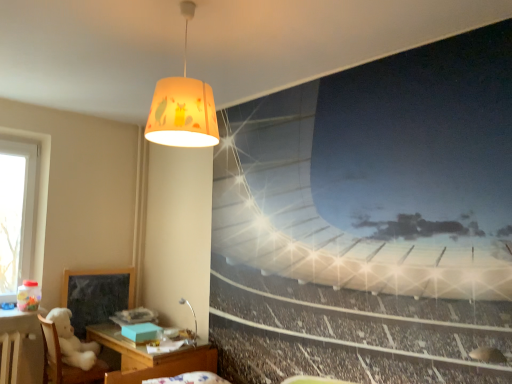
What do you see at coordinates (97, 295) in the screenshot?
I see `dark gray matte bulletin board at lower left` at bounding box center [97, 295].

Consider the image. Measure the distance between metallic silver desk lamp at lower center, arranged as the 1th lamp when ordered from the bottom, and camera.

metallic silver desk lamp at lower center, arranged as the 1th lamp when ordered from the bottom, and camera are 3.45 meters apart from each other.

In order to face metallic silver desk lamp at lower center, which is the 1th lamp in back-to-front order, should I rotate leftwards or rightwards?

To align with it, rotate left about 8.876°.

Identify the location of dark gray matte bulletin board at lower left. (97, 295).

Which object is closer to the camera, white plush bear at lower left or wooden table at lower left?

wooden table at lower left is in front.

Can you confirm if white plush bear at lower left is wider than wooden table at lower left?

Incorrect, the width of white plush bear at lower left does not surpass that of wooden table at lower left.

Would you say white plush bear at lower left is outside wooden table at lower left?

Yes.

From the image's perspective, between white plush bear at lower left and wooden table at lower left, which one is located above?

white plush bear at lower left.

Considering the sizes of objects white plush bear at lower left and matte yellow fabric lampshade at upper center, which appears as the first lamp when viewed from the top, in the image provided, who is shorter, white plush bear at lower left or matte yellow fabric lampshade at upper center, which appears as the first lamp when viewed from the top,?

With less height is matte yellow fabric lampshade at upper center, which appears as the first lamp when viewed from the top.

Is white plush bear at lower left touching matte yellow fabric lampshade at upper center, which is counted as the first lamp, starting from the front?

No, white plush bear at lower left is not touching matte yellow fabric lampshade at upper center, which is counted as the first lamp, starting from the front.

How many degrees apart are the facing directions of white plush bear at lower left and matte yellow fabric lampshade at upper center, which is counted as the 2th lamp, starting from the bottom?

They differ by 180 degrees in their facing directions.

Which is in front, white plush bear at lower left or matte yellow fabric lampshade at upper center, which appears as the first lamp when viewed from the top?

Positioned in front is matte yellow fabric lampshade at upper center, which appears as the first lamp when viewed from the top.

Is white plush bear at lower left inside the boundaries of dark gray matte bulletin board at lower left, or outside?

white plush bear at lower left cannot be found inside dark gray matte bulletin board at lower left.

Is white plush bear at lower left aimed at dark gray matte bulletin board at lower left?

No, white plush bear at lower left is not turned towards dark gray matte bulletin board at lower left.

Considering the relative positions of white plush bear at lower left and dark gray matte bulletin board at lower left in the image provided, is white plush bear at lower left behind dark gray matte bulletin board at lower left?

That is False.

Considering the positions of objects white plush bear at lower left and dark gray matte bulletin board at lower left in the image provided, who is more to the left, white plush bear at lower left or dark gray matte bulletin board at lower left?

Answer: From the viewer's perspective, white plush bear at lower left appears more on the left side.

Is point (155, 129) closer to camera compared to point (194, 343)?

Yes.

Which is in front, matte yellow fabric lampshade at upper center, which appears as the first lamp when viewed from the top, or metallic silver desk lamp at lower center, the 2th lamp in the front-to-back sequence?

matte yellow fabric lampshade at upper center, which appears as the first lamp when viewed from the top.

From a real-world perspective, which is physically below, matte yellow fabric lampshade at upper center, which is counted as the first lamp, starting from the front, or metallic silver desk lamp at lower center, which is the second lamp from top to bottom?

From a 3D spatial view, metallic silver desk lamp at lower center, which is the second lamp from top to bottom, is below.

Is matte yellow fabric lampshade at upper center, the second lamp positioned from the back, wider than metallic silver desk lamp at lower center, the 2th lamp in the front-to-back sequence?

Yes, matte yellow fabric lampshade at upper center, the second lamp positioned from the back, is wider than metallic silver desk lamp at lower center, the 2th lamp in the front-to-back sequence.

From a real-world perspective, which lamp is the 1st one above the wooden table at lower left? Please provide its 2D coordinates.

[(192, 313)]

Looking at this image, from the image's perspective, is wooden table at lower left below metallic silver desk lamp at lower center, which is the second lamp from top to bottom?

Yes, from the image's perspective, wooden table at lower left is beneath metallic silver desk lamp at lower center, which is the second lamp from top to bottom.

Considering the relative positions of metallic silver desk lamp at lower center, which is the second lamp from top to bottom, and white plush bear at lower left in the image provided, is metallic silver desk lamp at lower center, which is the second lamp from top to bottom, in front of white plush bear at lower left?

No, metallic silver desk lamp at lower center, which is the second lamp from top to bottom, is further to the viewer.

Is metallic silver desk lamp at lower center, arranged as the 1th lamp when ordered from the bottom, in contact with white plush bear at lower left?

metallic silver desk lamp at lower center, arranged as the 1th lamp when ordered from the bottom, and white plush bear at lower left are not in contact.

Is metallic silver desk lamp at lower center, which is the second lamp from top to bottom, oriented towards white plush bear at lower left?

No.

Measure the distance from dark gray matte bulletin board at lower left to white plush bear at lower left.

dark gray matte bulletin board at lower left and white plush bear at lower left are 19.79 inches apart from each other.

Who is smaller, dark gray matte bulletin board at lower left or white plush bear at lower left?

With smaller size is dark gray matte bulletin board at lower left.

Is dark gray matte bulletin board at lower left oriented towards white plush bear at lower left?

Yes, dark gray matte bulletin board at lower left is facing white plush bear at lower left.

Is dark gray matte bulletin board at lower left positioned beyond the bounds of white plush bear at lower left?

Absolutely, dark gray matte bulletin board at lower left is external to white plush bear at lower left.

What are the coordinates of `furniture above the wooden table at lower left (from the image's perspective)` in the screenshot? It's located at (64, 363).

Identify the location of furniture directly beneath the matte yellow fabric lampshade at upper center, the second lamp positioned from the back (from a real-world perspective). (64, 363).

Looking at this image, estimate the real-world distances between objects in this image. Which object is further from dark gray matte bulletin board at lower left, metallic silver desk lamp at lower center, the 2th lamp in the front-to-back sequence, or white plush bear at lower left?

metallic silver desk lamp at lower center, the 2th lamp in the front-to-back sequence, lies further to dark gray matte bulletin board at lower left than the other object.

Estimate the real-world distances between objects in this image. Which object is closer to wooden table at lower left, metallic silver desk lamp at lower center, which is the second lamp from top to bottom, or matte yellow fabric lampshade at upper center, the second lamp positioned from the back?

metallic silver desk lamp at lower center, which is the second lamp from top to bottom.

Looking at the image, which one is located further to white plush bear at lower left, metallic silver desk lamp at lower center, which is the second lamp from top to bottom, or wooden table at lower left?

metallic silver desk lamp at lower center, which is the second lamp from top to bottom.

From the picture: When comparing their distances from metallic silver desk lamp at lower center, which is the second lamp from top to bottom, does dark gray matte bulletin board at lower left or white plush bear at lower left seem further?

The object further to metallic silver desk lamp at lower center, which is the second lamp from top to bottom, is white plush bear at lower left.

Looking at the image, which one is located closer to white plush bear at lower left, wooden table at lower left or matte yellow fabric lampshade at upper center, which is counted as the 2th lamp, starting from the bottom?

wooden table at lower left lies closer to white plush bear at lower left than the other object.

From the image, which object appears to be nearer to dark gray matte bulletin board at lower left, matte yellow fabric lampshade at upper center, which is counted as the first lamp, starting from the front, or metallic silver desk lamp at lower center, which is the second lamp from top to bottom?

Based on the image, metallic silver desk lamp at lower center, which is the second lamp from top to bottom, appears to be nearer to dark gray matte bulletin board at lower left.

When comparing their distances from matte yellow fabric lampshade at upper center, which is counted as the first lamp, starting from the front, does metallic silver desk lamp at lower center, which is the second lamp from top to bottom, or wooden table at lower left seem further?

A: metallic silver desk lamp at lower center, which is the second lamp from top to bottom, is positioned further to the anchor matte yellow fabric lampshade at upper center, which is counted as the first lamp, starting from the front.

Which object lies further to the anchor point metallic silver desk lamp at lower center, which is the 1th lamp in back-to-front order, dark gray matte bulletin board at lower left or wooden table at lower left?

Among the two, dark gray matte bulletin board at lower left is located further to metallic silver desk lamp at lower center, which is the 1th lamp in back-to-front order.

At what (x,y) coordinates should I click in order to perform the action: click on furniture between matte yellow fabric lampshade at upper center, which is counted as the 2th lamp, starting from the bottom, and wooden table at lower left vertically. Please return your answer as a coordinate pair (x, y). This screenshot has height=384, width=512. Looking at the image, I should click on (64, 363).

This screenshot has height=384, width=512. Identify the location of table between dark gray matte bulletin board at lower left and metallic silver desk lamp at lower center, the 2th lamp in the front-to-back sequence, in the horizontal direction. (150, 357).

The image size is (512, 384). What are the coordinates of `bulletin board between matte yellow fabric lampshade at upper center, which is counted as the first lamp, starting from the front, and wooden table at lower left in the up-down direction` in the screenshot? It's located at (x=97, y=295).

At what (x,y) coordinates should I click in order to perform the action: click on lamp between matte yellow fabric lampshade at upper center, the second lamp positioned from the back, and wooden table at lower left from top to bottom. Please return your answer as a coordinate pair (x, y). The width and height of the screenshot is (512, 384). Looking at the image, I should click on (192, 313).